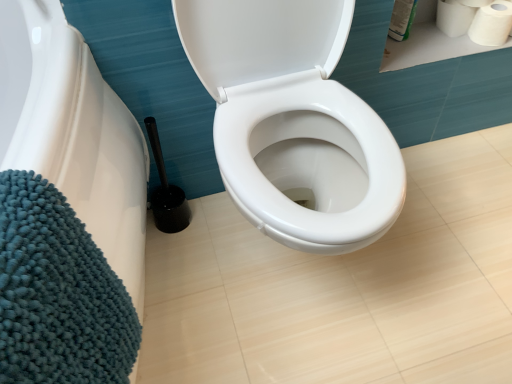
Question: Is white matte toilet paper at upper right, marked as the 2th toilet paper in a right-to-left arrangement, far away from white matte toilet paper at upper right, which is the 2th toilet paper in left-to-right order?

Choices:
 (A) yes
 (B) no

Answer: (B)

Question: Is white matte toilet paper at upper right, arranged as the first toilet paper when viewed from the left, not inside white matte toilet paper at upper right, which is the 2th toilet paper in left-to-right order?

Choices:
 (A) no
 (B) yes

Answer: (B)

Question: Is white matte toilet paper at upper right, arranged as the first toilet paper when viewed from the left, taller than white matte toilet paper at upper right, the 1th toilet paper positioned from the right?

Choices:
 (A) no
 (B) yes

Answer: (A)

Question: Is white matte toilet paper at upper right, arranged as the first toilet paper when viewed from the left, positioned with its back to white matte toilet paper at upper right, the 1th toilet paper positioned from the right?

Choices:
 (A) no
 (B) yes

Answer: (A)

Question: Does white matte toilet paper at upper right, marked as the 2th toilet paper in a right-to-left arrangement, lie behind white matte toilet paper at upper right, the 1th toilet paper positioned from the right?

Choices:
 (A) yes
 (B) no

Answer: (A)

Question: From the image's perspective, would you say white matte toilet paper at upper right, arranged as the first toilet paper when viewed from the left, is shown under white matte toilet paper at upper right, which is the 2th toilet paper in left-to-right order?

Choices:
 (A) no
 (B) yes

Answer: (A)

Question: Is white matte toilet paper at upper right, marked as the 2th toilet paper in a right-to-left arrangement, behind black plastic toilet brush at lower left?

Choices:
 (A) yes
 (B) no

Answer: (A)

Question: Does white matte toilet paper at upper right, arranged as the first toilet paper when viewed from the left, have a greater height compared to black plastic toilet brush at lower left?

Choices:
 (A) yes
 (B) no

Answer: (B)

Question: Is white matte toilet paper at upper right, marked as the 2th toilet paper in a right-to-left arrangement, looking in the opposite direction of black plastic toilet brush at lower left?

Choices:
 (A) no
 (B) yes

Answer: (A)

Question: Is white matte toilet paper at upper right, marked as the 2th toilet paper in a right-to-left arrangement, positioned beyond the bounds of black plastic toilet brush at lower left?

Choices:
 (A) no
 (B) yes

Answer: (B)

Question: Is white matte toilet paper at upper right, arranged as the first toilet paper when viewed from the left, at the left side of black plastic toilet brush at lower left?

Choices:
 (A) no
 (B) yes

Answer: (A)

Question: Is white matte toilet paper at upper right, arranged as the first toilet paper when viewed from the left, to the right of black plastic toilet brush at lower left from the viewer's perspective?

Choices:
 (A) no
 (B) yes

Answer: (B)

Question: Is white matte toilet paper at upper right, the 1th toilet paper positioned from the right, outside of black plastic toilet brush at lower left?

Choices:
 (A) yes
 (B) no

Answer: (A)